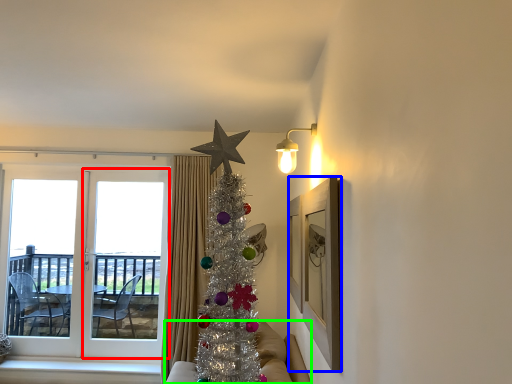
Question: Considering the real-world distances, which object is closest to screen door (highlighted by a red box)? picture frame (highlighted by a blue box) or studio couch (highlighted by a green box).

Choices:
 (A) picture frame
 (B) studio couch

Answer: (B)